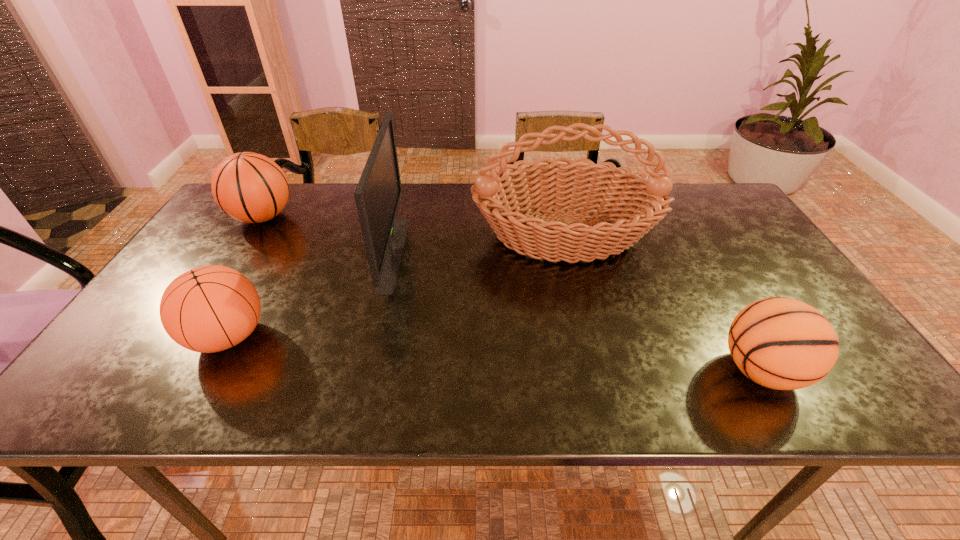
Where is `free space between the monitor and the basket`? free space between the monitor and the basket is located at coordinates (479, 245).

This screenshot has height=540, width=960. What are the coordinates of `vacant area between the monitor and the farthest basketball` in the screenshot? It's located at [x=327, y=235].

Locate an element on the screen. The image size is (960, 540). free area in between the basket and the rightmost basketball is located at coordinates (662, 303).

Identify the location of vacant area between the farthest basketball and the basket. This screenshot has width=960, height=540. (414, 226).

Find the location of a particular element. vacant space that is in between the basket and the farthest basketball is located at coordinates (414, 226).

Where is `free spot between the rightmost basketball and the basket`? This screenshot has width=960, height=540. free spot between the rightmost basketball and the basket is located at coordinates coord(662,303).

You are a GUI agent. You are given a task and a screenshot of the screen. Output one action in this format:
    pyautogui.click(x=<x>, y=<y>)
    Task: Click on the vacant area that lies between the rightmost basketball and the basket
    
    Given the screenshot: What is the action you would take?
    pyautogui.click(x=662, y=303)

Identify the location of vacant space in between the farthest basketball and the rightmost basketball. The height and width of the screenshot is (540, 960). (512, 294).

This screenshot has width=960, height=540. In order to click on free space between the basket and the third object from left to right in this screenshot , I will do `click(479, 245)`.

I want to click on the closest object to the farthest basketball, so click(208, 309).